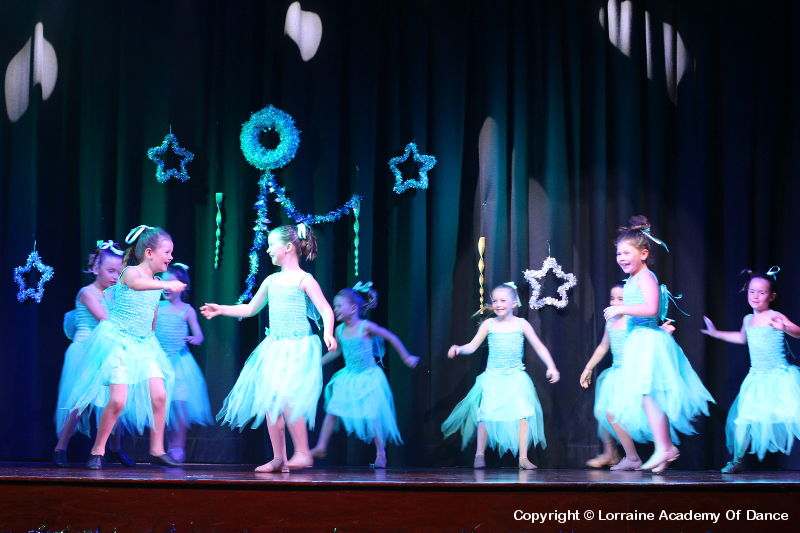
The height and width of the screenshot is (533, 800). What are the coordinates of `blue star decorations` in the screenshot? It's located at (52, 278), (182, 149), (438, 179).